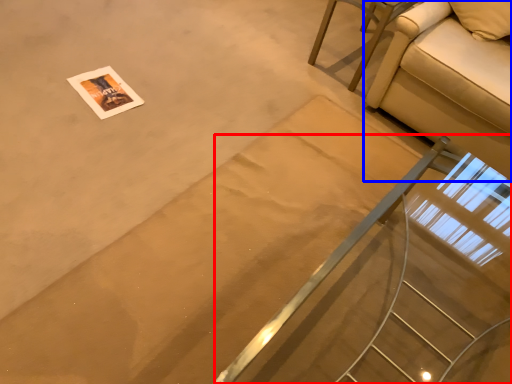
Question: Which point is further to the camera, stairs (highlighted by a red box) or studio couch (highlighted by a blue box)?

Choices:
 (A) stairs
 (B) studio couch

Answer: (B)